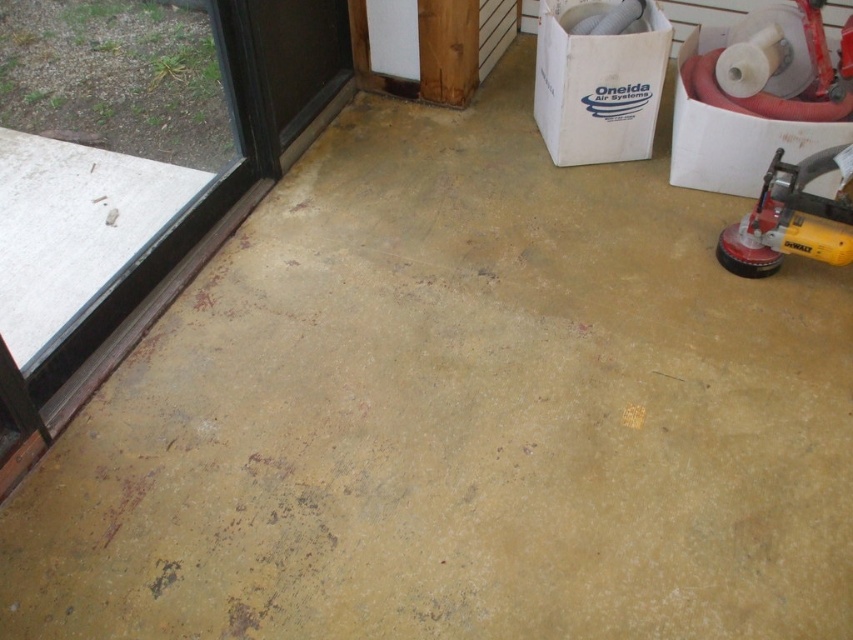
Question: Is transparent glass door at left smaller than yellow plastic sander at right?

Choices:
 (A) no
 (B) yes

Answer: (A)

Question: Is transparent glass door at left to the right of yellow plastic sander at right from the viewer's perspective?

Choices:
 (A) no
 (B) yes

Answer: (A)

Question: Which of the following is the farthest from the observer?

Choices:
 (A) transparent glass door at left
 (B) yellow plastic sander at right

Answer: (B)

Question: Which of the following is the farthest from the observer?

Choices:
 (A) yellow plastic sander at right
 (B) transparent glass door at left

Answer: (A)

Question: Does transparent glass door at left have a larger size compared to yellow plastic sander at right?

Choices:
 (A) yes
 (B) no

Answer: (A)